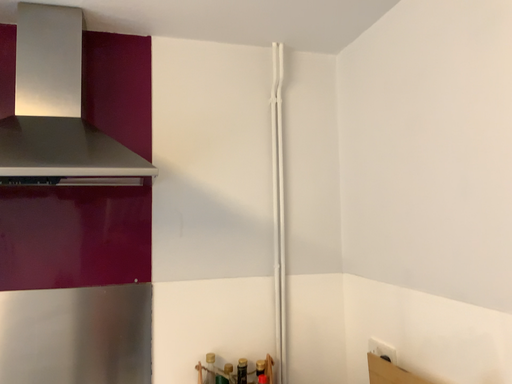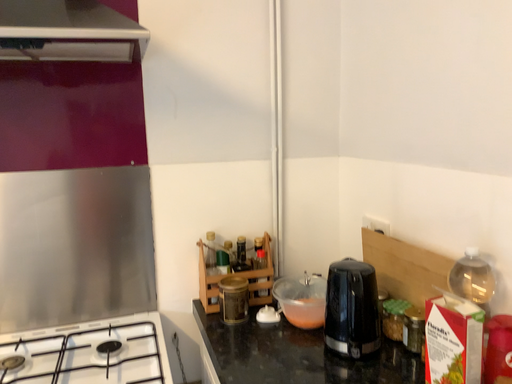
Question: Which way did the camera rotate in the video?

Choices:
 (A) rotated downward
 (B) rotated upward

Answer: (A)